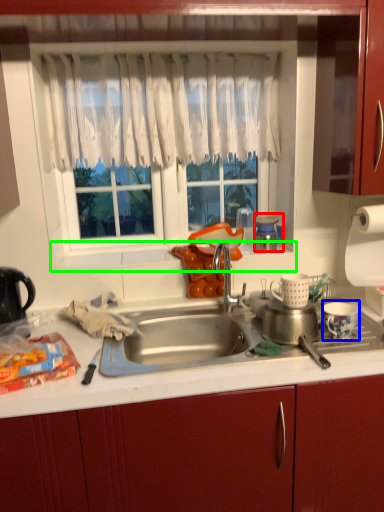
Question: Which object is positioned closest to appliance (highlighted by a red box)? Select from appliance (highlighted by a blue box) and window sill (highlighted by a green box).

Choices:
 (A) appliance
 (B) window sill

Answer: (B)